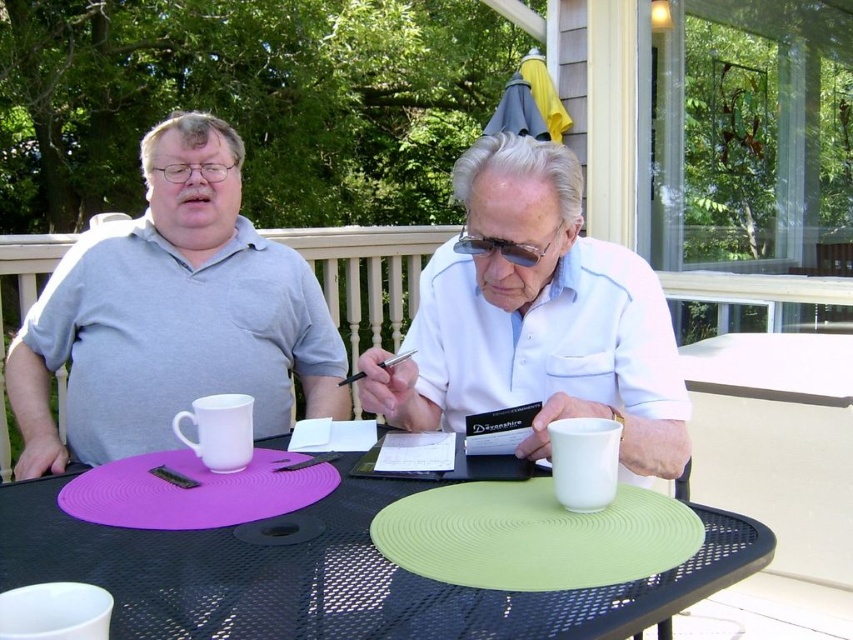
Question: Which object is farther from the camera taking this photo?

Choices:
 (A) matte gray shirt at left
 (B) green rubber placemat at center
 (C) matte white mug at center
 (D) white matte shirt at center

Answer: (A)

Question: Does green rubber placemat at center appear on the right side of white matte shirt at center?

Choices:
 (A) no
 (B) yes

Answer: (A)

Question: Is white matte shirt at center to the left of matte white mug at center from the viewer's perspective?

Choices:
 (A) no
 (B) yes

Answer: (A)

Question: Does matte gray shirt at left have a lesser width compared to green rubber placemat at center?

Choices:
 (A) no
 (B) yes

Answer: (B)

Question: Which of the following is the closest to the observer?

Choices:
 (A) (706, 550)
 (B) (523, 236)
 (C) (323, 339)
 (D) (108, 432)

Answer: (A)

Question: Among these points, which one is nearest to the camera?

Choices:
 (A) (45, 307)
 (B) (376, 500)
 (C) (138, 419)
 (D) (456, 368)

Answer: (B)